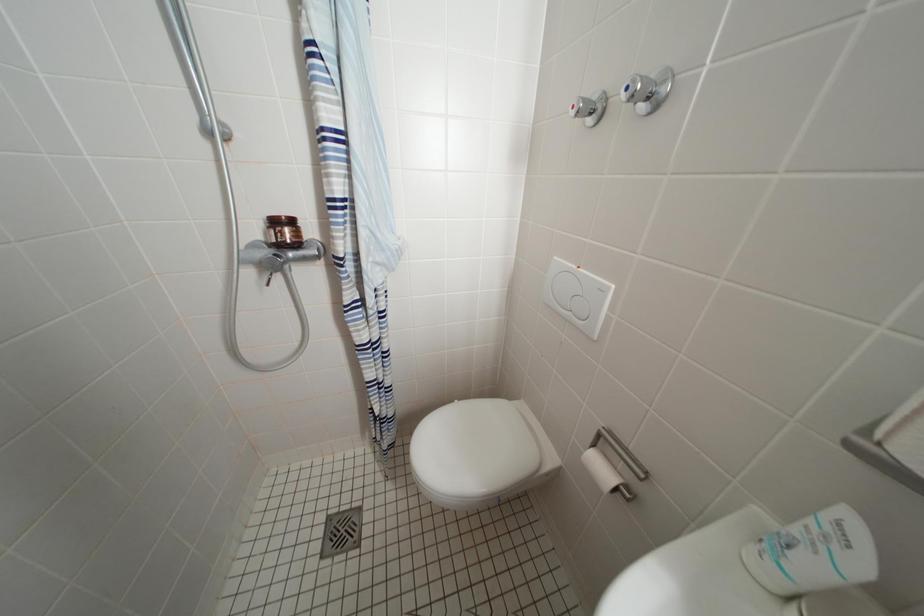
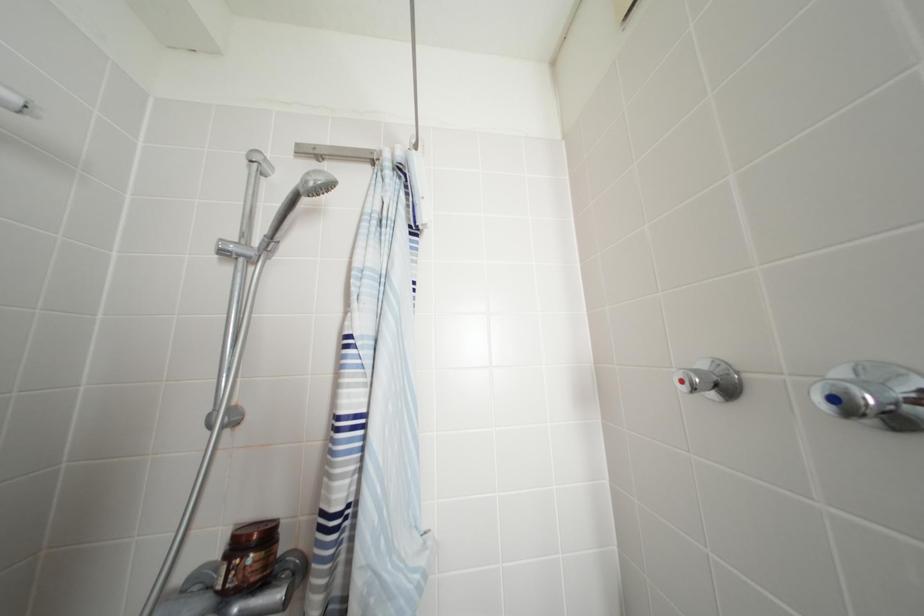
Question: How did the camera likely rotate?

Choices:
 (A) Left
 (B) Right
 (C) Up
 (D) Down

Answer: (C)